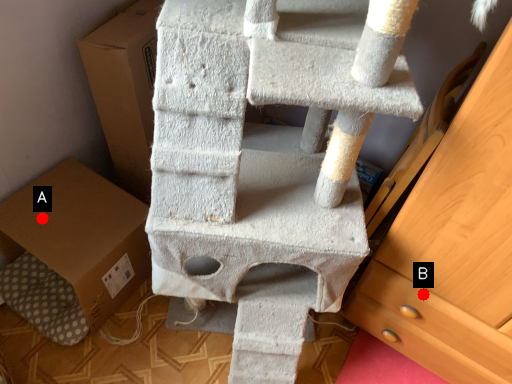
Question: Two points are circled on the image, labeled by A and B beside each circle. Which of the following is the farthest from the observer?

Choices:
 (A) A is further
 (B) B is further

Answer: (A)